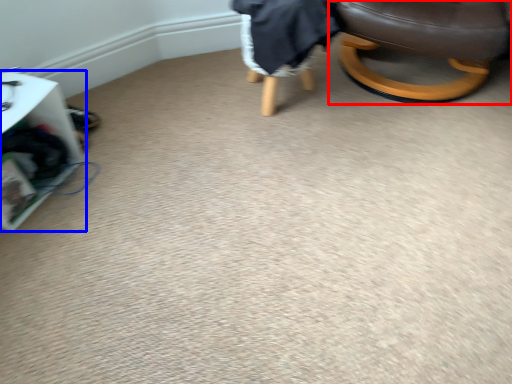
Question: Among these objects, which one is nearest to the camera, chair (highlighted by a red box) or furniture (highlighted by a blue box)?

Choices:
 (A) chair
 (B) furniture

Answer: (B)